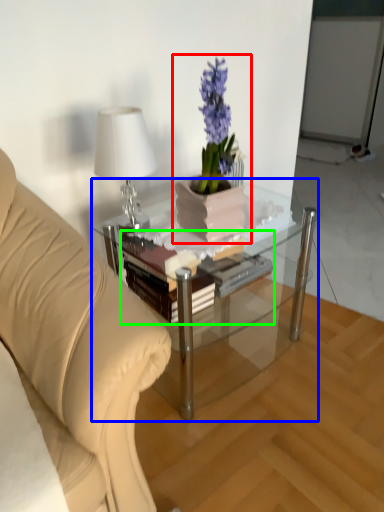
Question: Which is farther away from houseplant (highlighted by a red box)? coffee table (highlighted by a blue box) or book (highlighted by a green box)?

Choices:
 (A) coffee table
 (B) book

Answer: (A)